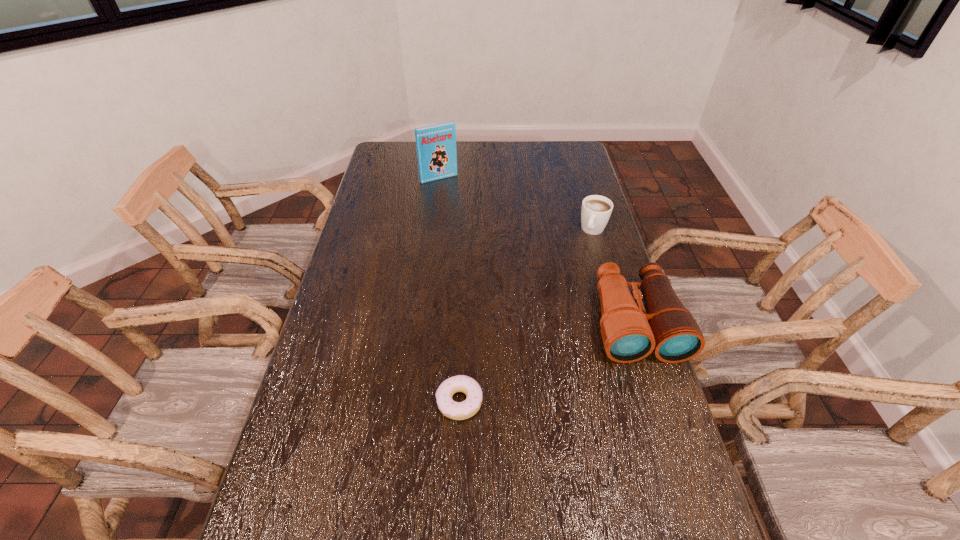
Image resolution: width=960 pixels, height=540 pixels. I want to click on vacant space on the desktop that is between the nearest object and the binoculars and is positioned on the front cover of the farthest object, so click(562, 355).

This screenshot has height=540, width=960. In order to click on free space on the desktop that is between the shortest object and the third shortest object and is positioned with the handle on the side of the second shortest object in this screenshot , I will do `click(529, 370)`.